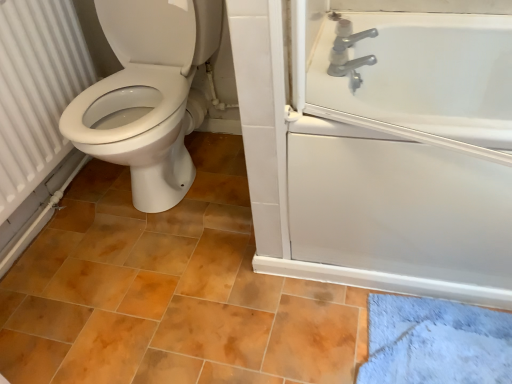
Locate an element on the screen. blank area beneath white textured radiator at left (from a real-world perspective) is located at coordinates (90, 178).